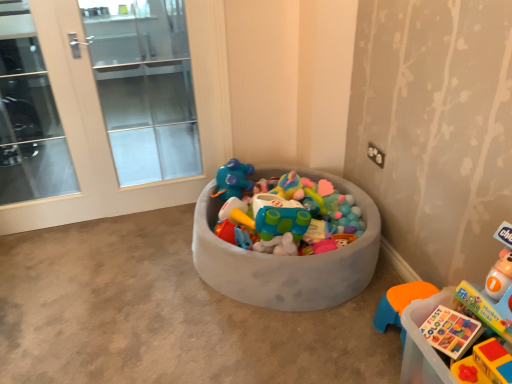
Question: From a real-world perspective, is clear glass door at left, which appears as the 1th screen door when viewed from the left, physically located above or below white glass screen door at left, positioned as the second screen door in left-to-right order?

Choices:
 (A) below
 (B) above

Answer: (B)

Question: Is clear glass door at left, the 2th screen door viewed from the right, taller or shorter than white glass screen door at left, positioned as the second screen door in left-to-right order?

Choices:
 (A) tall
 (B) short

Answer: (B)

Question: Which object is positioned farthest from the rubberized plastic toy at lower right, the second toy viewed from the back?

Choices:
 (A) white glass screen door at left, positioned as the second screen door in left-to-right order
 (B) translucent plastic book at lower right, which is the first toy from back to front
 (C) clear glass door at left, the 2th screen door viewed from the right
 (D) gray fabric toy bin at center

Answer: (C)

Question: Which is farther from the translucent plastic book at lower right, the second toy from the front?

Choices:
 (A) clear glass door at left, the 2th screen door viewed from the right
 (B) white glass screen door at left, which ranks as the 1th screen door in right-to-left order
 (C) gray fabric toy bin at center
 (D) rubberized plastic toy at lower right, the second toy viewed from the back

Answer: (A)